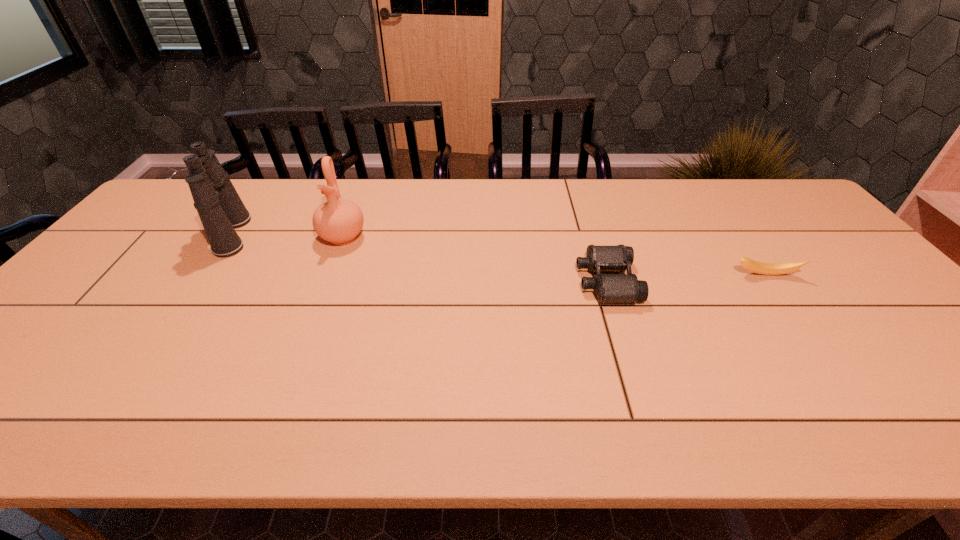
Identify the location of free space located through the eyepieces of the shorter binoculars. This screenshot has width=960, height=540. (438, 281).

Image resolution: width=960 pixels, height=540 pixels. In order to click on free space located 0.140m at the stem of the banana in this screenshot , I will do `click(795, 318)`.

Locate an element on the screen. The height and width of the screenshot is (540, 960). object that is at the far edge is located at coordinates (220, 208).

You are a GUI agent. You are given a task and a screenshot of the screen. Output one action in this format:
    pyautogui.click(x=<x>, y=<y>)
    Task: Click on the blank space at the far edge
    The width and height of the screenshot is (960, 540).
    Given the screenshot: What is the action you would take?
    pyautogui.click(x=560, y=183)

The width and height of the screenshot is (960, 540). In the image, there is a desktop. Find the location of `vacant space at the near edge`. vacant space at the near edge is located at coordinates (684, 405).

You are a GUI agent. You are given a task and a screenshot of the screen. Output one action in this format:
    pyautogui.click(x=<x>, y=<y>)
    Task: Click on the free space at the left edge of the desktop
    This screenshot has height=540, width=960.
    Given the screenshot: What is the action you would take?
    pyautogui.click(x=59, y=345)

Identify the location of free space at the right edge. (846, 266).

In the image, there is a desktop. At what (x,y) coordinates should I click in order to perform the action: click on free space at the far left corner. Please return your answer as a coordinate pair (x, y). The height and width of the screenshot is (540, 960). Looking at the image, I should click on (167, 206).

Where is `vacant position at the near right corner of the desktop`? The height and width of the screenshot is (540, 960). vacant position at the near right corner of the desktop is located at coordinates (957, 404).

I want to click on free space between the taller binoculars and the shorter binoculars, so click(x=420, y=258).